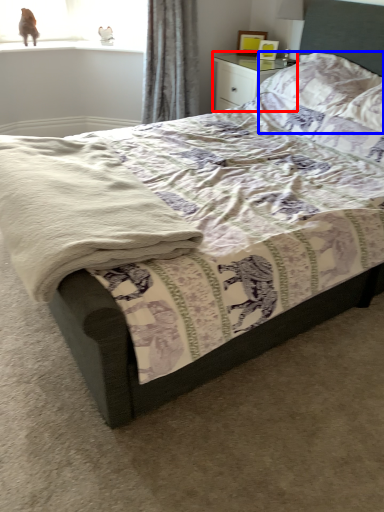
Question: Which object appears farthest to the camera in this image, nightstand (highlighted by a red box) or pillow (highlighted by a blue box)?

Choices:
 (A) nightstand
 (B) pillow

Answer: (A)